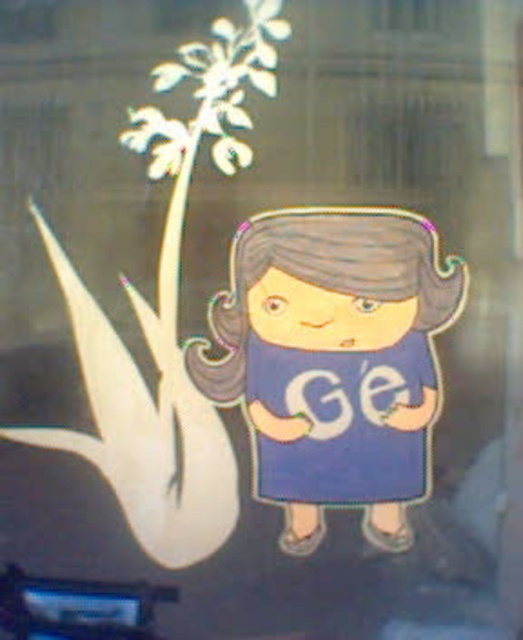
Question: Among these objects, which one is nearest to the camera?

Choices:
 (A) matte blue dress at center
 (B) blue fabric dress at center

Answer: (A)

Question: Among these points, which one is nearest to the camera?

Choices:
 (A) (345, 324)
 (B) (360, 449)

Answer: (A)

Question: Does matte blue dress at center have a larger size compared to blue fabric dress at center?

Choices:
 (A) no
 (B) yes

Answer: (B)

Question: Observing the image, what is the correct spatial positioning of matte blue dress at center in reference to blue fabric dress at center?

Choices:
 (A) right
 (B) left

Answer: (B)

Question: Among these objects, which one is farthest from the camera?

Choices:
 (A) blue fabric dress at center
 (B) matte blue dress at center

Answer: (A)

Question: Does matte blue dress at center lie in front of blue fabric dress at center?

Choices:
 (A) no
 (B) yes

Answer: (B)